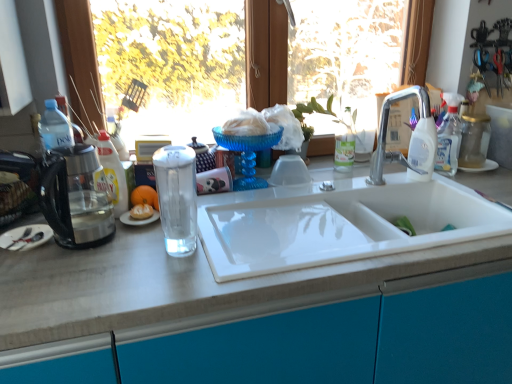
At what (x,y) coordinates should I click in order to perform the action: click on free spot in front of white fluffy food at center. Please return your answer as a coordinate pair (x, y). The height and width of the screenshot is (384, 512). Looking at the image, I should click on (122, 243).